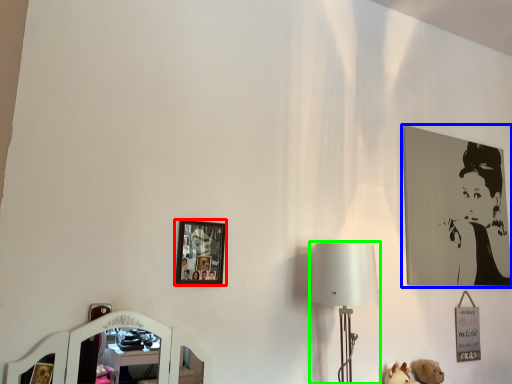
Question: Estimate the real-world distances between objects in this image. Which object is farther from picture frame (highlighted by a red box), picture frame (highlighted by a blue box) or table lamp (highlighted by a green box)?

Choices:
 (A) picture frame
 (B) table lamp

Answer: (A)